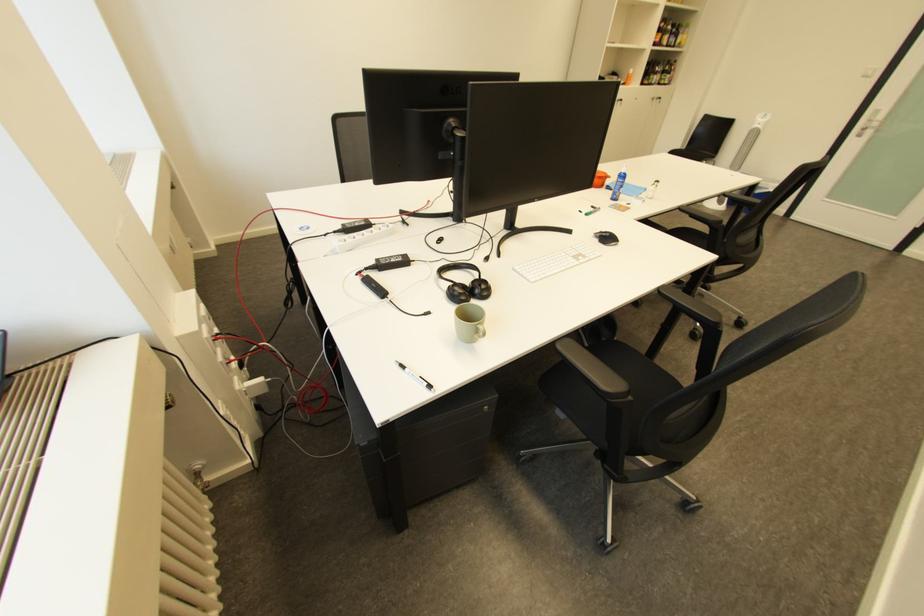
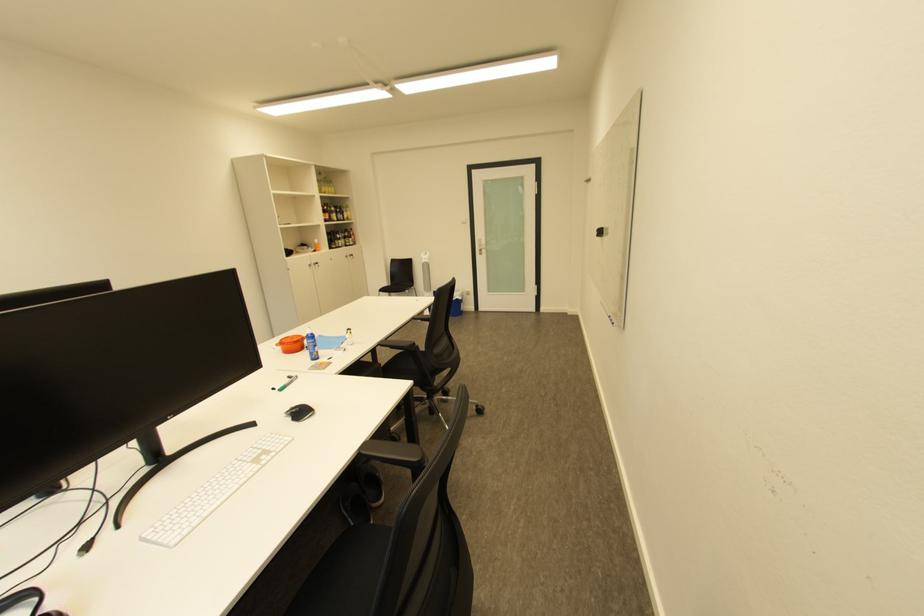
Find the pixel in the second image that matches (x=672, y=288) in the first image.

(373, 446)